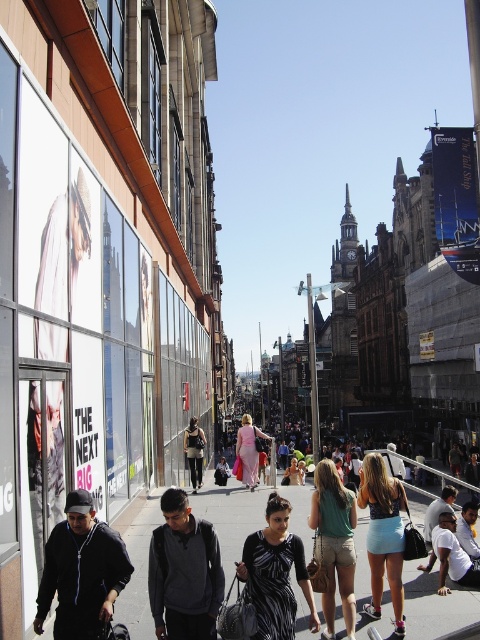
You are a photographer trying to capture a candid shot of both the blue denim shorts at center and the matte pink dress at center in the same frame. Given their positions, which clothing item would you need to focus on first to ensure both are in the frame?

The blue denim shorts at center occupies less space than the matte pink dress at center, so you should focus on the matte pink dress at center first to ensure both are in the frame.

You are standing at the point marked as point (230, 516) in the image. What is the material of the surface you are standing on?

The smooth concrete pavement at center is located at point (230, 516), so the surface is made of smooth concrete.